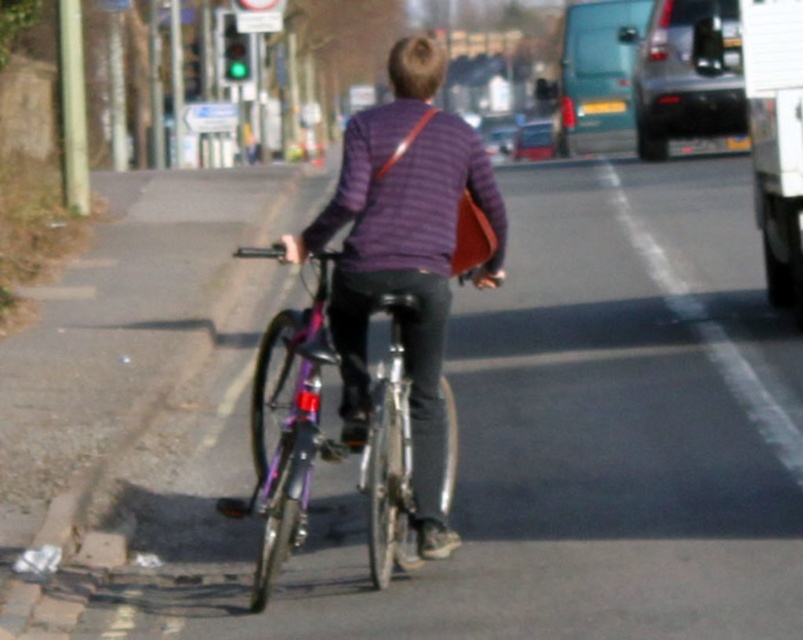
Can you confirm if purple striped sweater at center is positioned below shiny purple bicycle at center?

Actually, purple striped sweater at center is above shiny purple bicycle at center.

Can you confirm if purple striped sweater at center is wider than shiny purple bicycle at center?

No, purple striped sweater at center is not wider than shiny purple bicycle at center.

What do you see at coordinates (404, 253) in the screenshot? I see `purple striped sweater at center` at bounding box center [404, 253].

This screenshot has width=803, height=640. Identify the location of purple striped sweater at center. (404, 253).